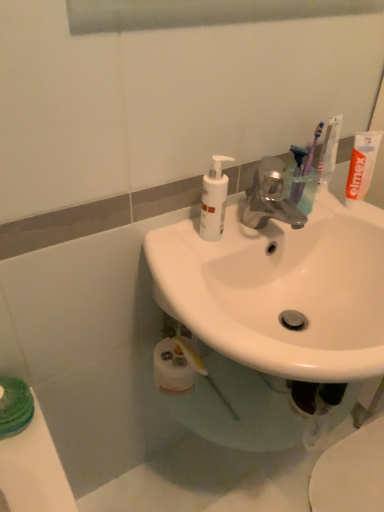
This screenshot has height=512, width=384. What are the coordinates of `vacant area that lies between white matte pump bottle at upper center and white matte toothpaste at upper right` in the screenshot? It's located at (276, 222).